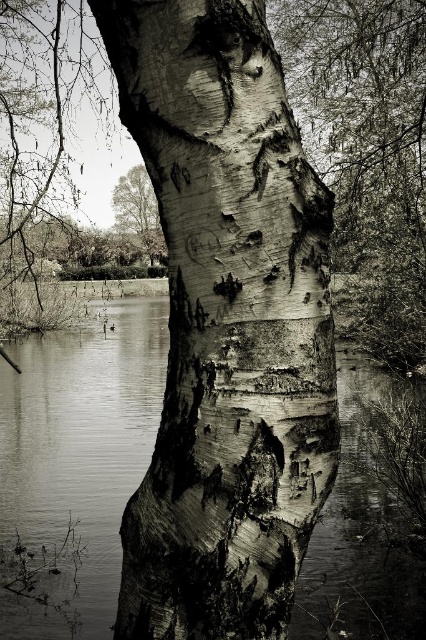
Question: Does smooth bark tree trunk at center lie behind smooth water at center?

Choices:
 (A) yes
 (B) no

Answer: (B)

Question: Which point is farther to the camera?

Choices:
 (A) (86, 488)
 (B) (270, 369)

Answer: (A)

Question: Which point is closer to the camera?

Choices:
 (A) (20, 392)
 (B) (212, 316)

Answer: (B)

Question: Does smooth bark tree trunk at center come behind smooth water at center?

Choices:
 (A) no
 (B) yes

Answer: (A)

Question: Does smooth bark tree trunk at center appear under smooth water at center?

Choices:
 (A) yes
 (B) no

Answer: (B)